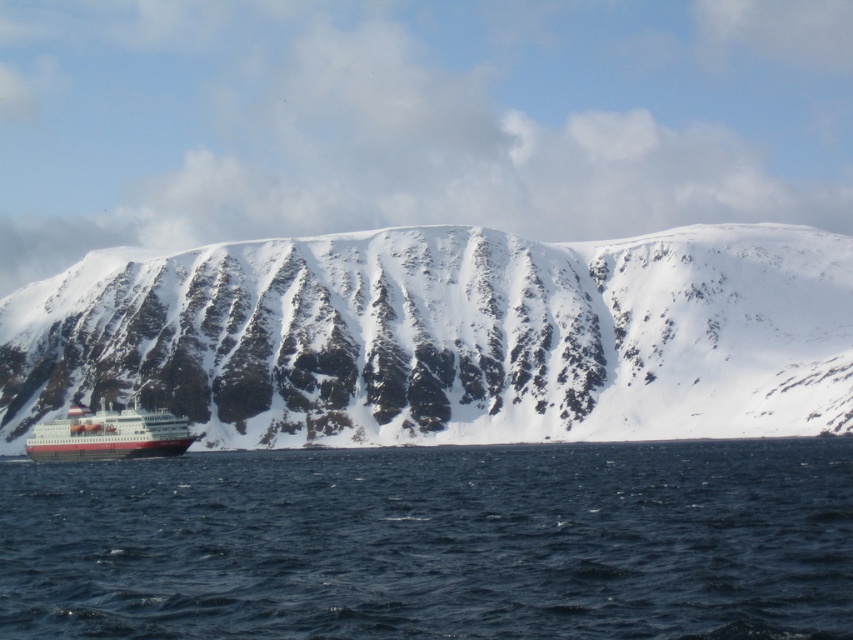
Between snowy rock mountain at lower left and blue water at lower center, which one is positioned higher?

snowy rock mountain at lower left is higher up.

Locate an element on the screen. The image size is (853, 640). snowy rock mountain at lower left is located at coordinates (447, 337).

The height and width of the screenshot is (640, 853). I want to click on snowy rock mountain at lower left, so click(447, 337).

Who is taller, snowy rock mountain at lower left or red matte ship at lower left?

snowy rock mountain at lower left is taller.

Consider the image. Does snowy rock mountain at lower left come in front of red matte ship at lower left?

Yes, it is.

The height and width of the screenshot is (640, 853). Find the location of `snowy rock mountain at lower left`. snowy rock mountain at lower left is located at coordinates (447, 337).

Does blue water at lower center lie behind red matte ship at lower left?

No, blue water at lower center is in front of red matte ship at lower left.

Between blue water at lower center and red matte ship at lower left, which one appears on the right side from the viewer's perspective?

Positioned to the right is blue water at lower center.

Which is in front, point (15, 490) or point (105, 412)?

Point (15, 490) is in front.

This screenshot has width=853, height=640. I want to click on blue water at lower center, so click(x=434, y=541).